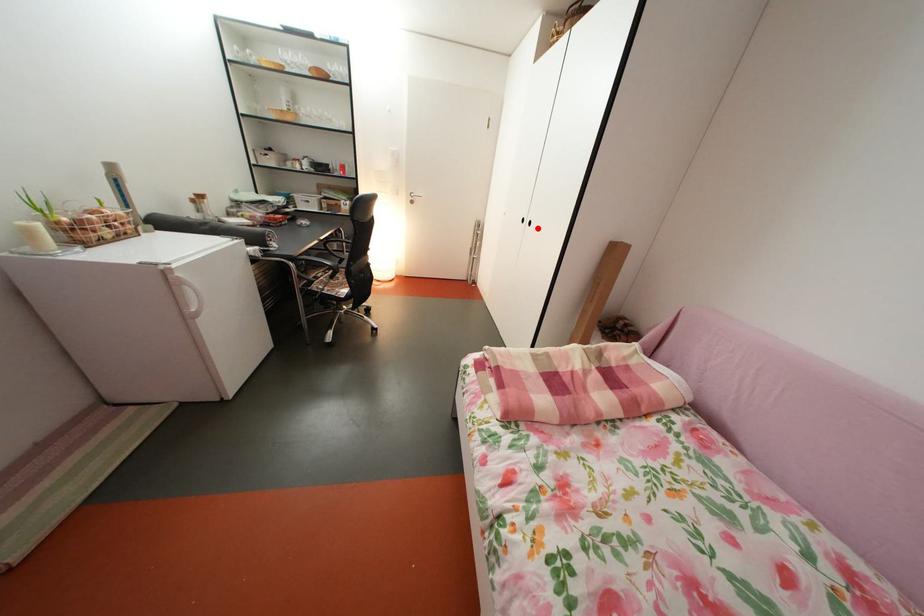
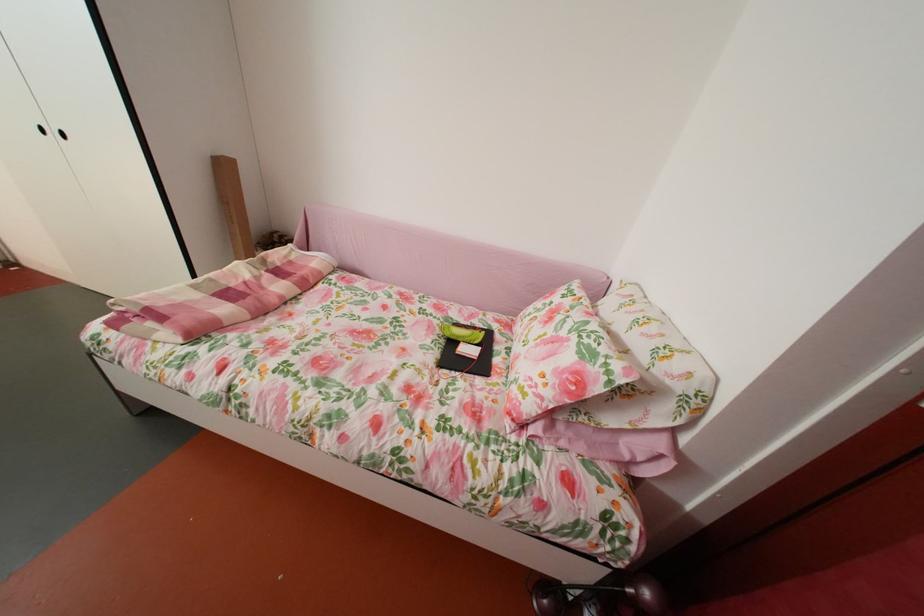
Question: I am providing you with two images of the same scene from different viewpoints. A red point is shown in image1. For the corresponding object point in image2, is it positioned nearer or farther from the camera?

Choices:
 (A) Nearer
 (B) Farther

Answer: (A)